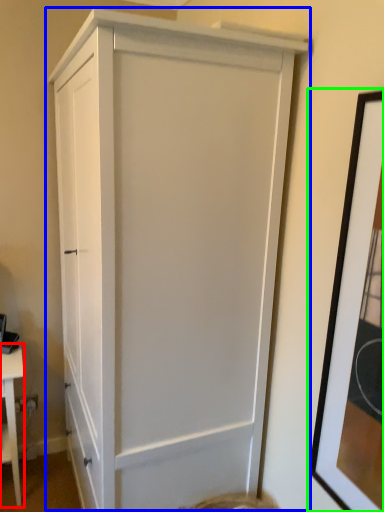
Question: Which object is positioned farthest from table (highlighted by a red box)? Select from cupboard (highlighted by a blue box) and picture frame (highlighted by a green box).

Choices:
 (A) cupboard
 (B) picture frame

Answer: (B)